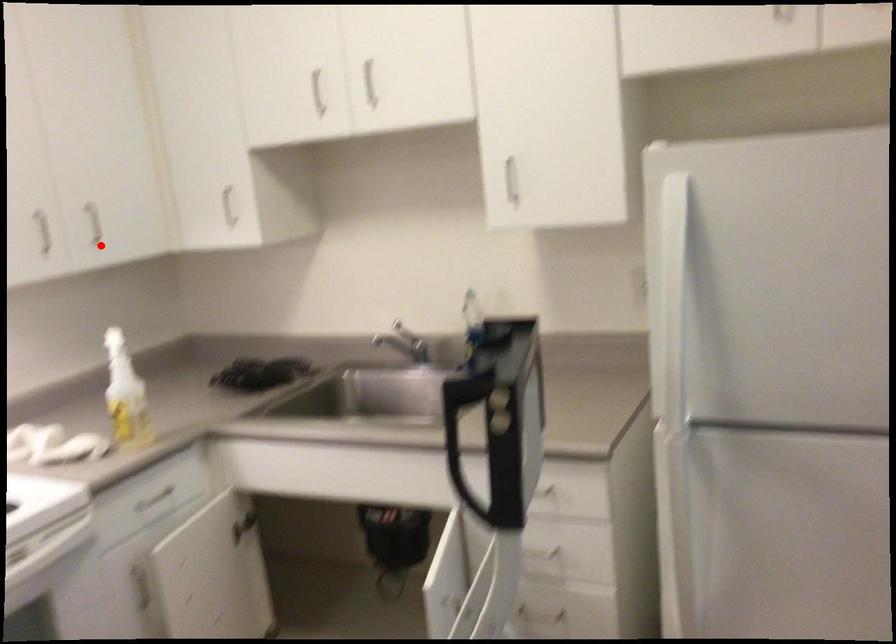
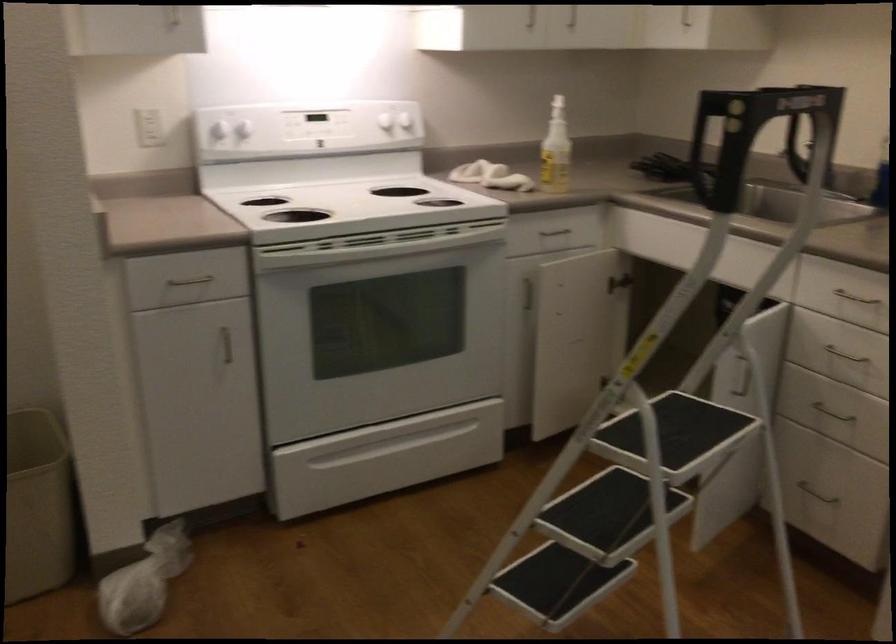
Question: I am providing you with two images of the same scene from different viewpoints. In image1, a red point is highlighted. Considering the same 3D point in image2, which of the following is correct?

Choices:
 (A) It is closer
 (B) It is farther

Answer: (B)